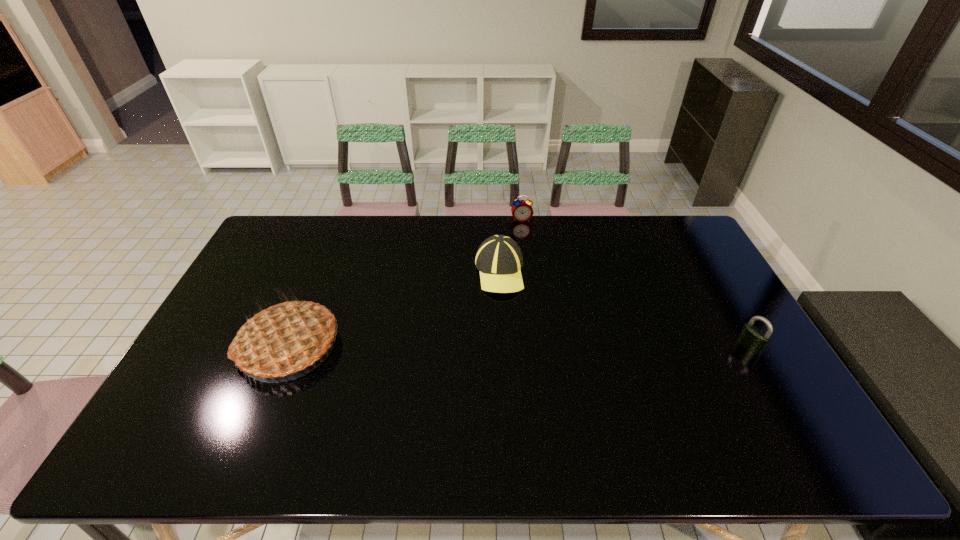
Locate an element on the screen. The height and width of the screenshot is (540, 960). vacant space located 0.090m on the front-facing side of the alarm clock is located at coordinates (524, 237).

I want to click on free space located 0.080m on the front-facing side of the alarm clock, so click(524, 235).

This screenshot has height=540, width=960. In order to click on free space located on the front-facing side of the alarm clock in this screenshot , I will do `click(526, 244)`.

Where is `baseball cap located in the far edge section of the desktop`? baseball cap located in the far edge section of the desktop is located at coordinates (499, 259).

I want to click on alarm clock that is at the far edge, so click(522, 211).

Identify the location of object that is at the left edge. (284, 338).

This screenshot has width=960, height=540. I want to click on object that is positioned at the right edge, so click(752, 338).

Where is `free region at the far edge`? This screenshot has height=540, width=960. free region at the far edge is located at coordinates (412, 220).

Identify the location of free space at the near edge of the desktop. (284, 409).

At what (x,y) coordinates should I click in order to perform the action: click on blank area at the left edge. Please return your answer as a coordinate pair (x, y). This screenshot has width=960, height=540. Looking at the image, I should click on (198, 385).